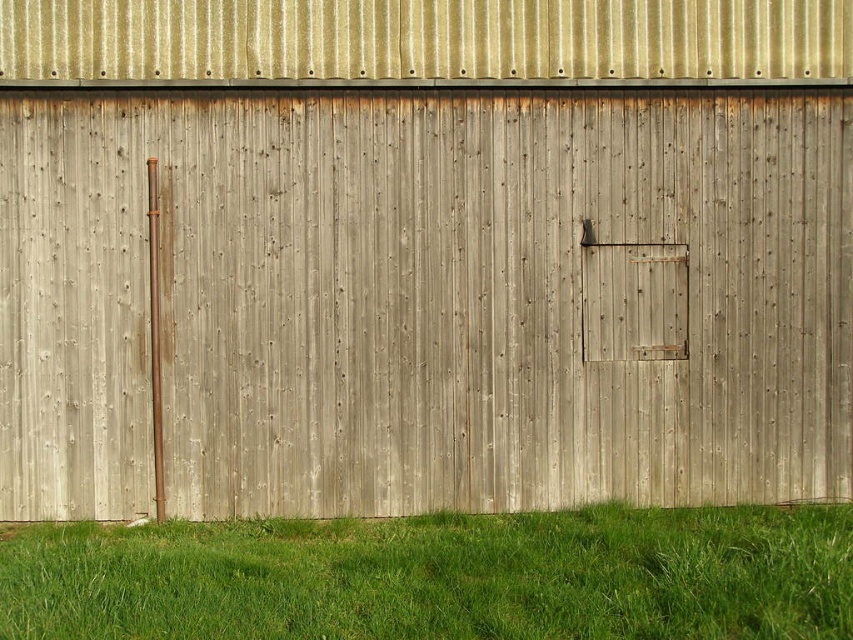
Question: Is weathered wood door at center closer to the viewer compared to green grass at lower center?

Choices:
 (A) yes
 (B) no

Answer: (B)

Question: Which of the following is the farthest from the observer?

Choices:
 (A) green grass at lower center
 (B) weathered wood door at center

Answer: (B)

Question: Is weathered wood door at center to the left of green grass at lower center from the viewer's perspective?

Choices:
 (A) yes
 (B) no

Answer: (A)

Question: Which object is closer to the camera taking this photo?

Choices:
 (A) weathered wood door at center
 (B) green grass at lower center

Answer: (B)

Question: Is the position of weathered wood door at center more distant than that of green grass at lower center?

Choices:
 (A) yes
 (B) no

Answer: (A)